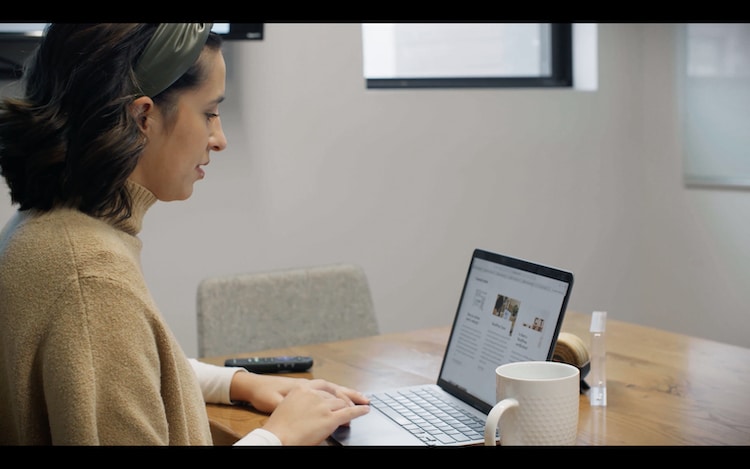
In order to click on remote control in this screenshot , I will do `click(260, 358)`.